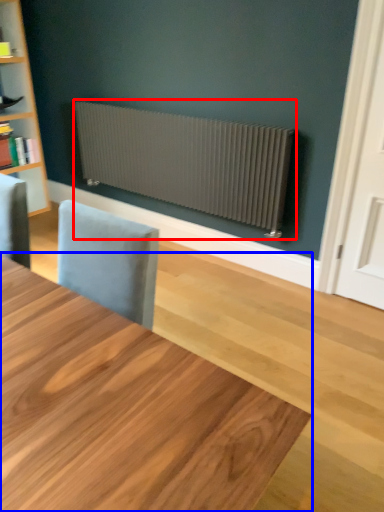
Question: Which point is further to the camera, radiator (highlighted by a red box) or table (highlighted by a blue box)?

Choices:
 (A) radiator
 (B) table

Answer: (A)